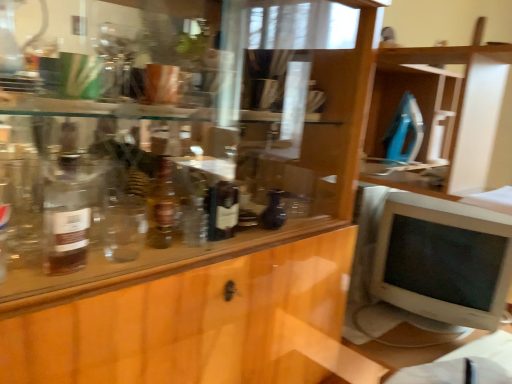
Question: Should I look upward or downward to see white plastic monitor at right?

Choices:
 (A) up
 (B) down

Answer: (B)

Question: Is matte black vase at center, acting as the 1th bottle starting from the right, further to camera compared to white plastic monitor at right?

Choices:
 (A) yes
 (B) no

Answer: (B)

Question: Is matte black vase at center, which ranks as the 1th bottle in back-to-front order, wider than white plastic monitor at right?

Choices:
 (A) yes
 (B) no

Answer: (B)

Question: Can we say matte black vase at center, arranged as the second bottle when viewed from the left, lies outside white plastic monitor at right?

Choices:
 (A) no
 (B) yes

Answer: (B)

Question: Is matte black vase at center, arranged as the second bottle when viewed from the left, far from white plastic monitor at right?

Choices:
 (A) no
 (B) yes

Answer: (A)

Question: Can you confirm if matte black vase at center, the second bottle positioned from the front, is thinner than white plastic monitor at right?

Choices:
 (A) no
 (B) yes

Answer: (B)

Question: Does matte black vase at center, acting as the 1th bottle starting from the right, lie in front of white plastic monitor at right?

Choices:
 (A) no
 (B) yes

Answer: (B)

Question: Is the surface of translucent glass bottle at left, the 1th bottle when ordered from left to right, in direct contact with white glossy table at lower right?

Choices:
 (A) yes
 (B) no

Answer: (B)

Question: Is translucent glass bottle at left, acting as the 2th bottle starting from the right, oriented away from white glossy table at lower right?

Choices:
 (A) yes
 (B) no

Answer: (B)

Question: Is translucent glass bottle at left, which is counted as the second bottle, starting from the back, to the right of white glossy table at lower right from the viewer's perspective?

Choices:
 (A) yes
 (B) no

Answer: (B)

Question: From a real-world perspective, is translucent glass bottle at left, acting as the 2th bottle starting from the right, positioned over white glossy table at lower right based on gravity?

Choices:
 (A) yes
 (B) no

Answer: (A)

Question: Does translucent glass bottle at left, acting as the 2th bottle starting from the right, appear on the left side of white glossy table at lower right?

Choices:
 (A) yes
 (B) no

Answer: (A)

Question: Does translucent glass bottle at left, the 1th bottle when ordered from left to right, come behind white glossy table at lower right?

Choices:
 (A) yes
 (B) no

Answer: (A)

Question: Is white plastic monitor at right not close to translucent glass bottle at left, which is counted as the first bottle, starting from the front?

Choices:
 (A) yes
 (B) no

Answer: (A)